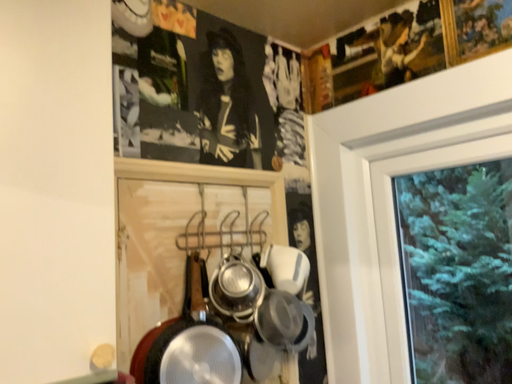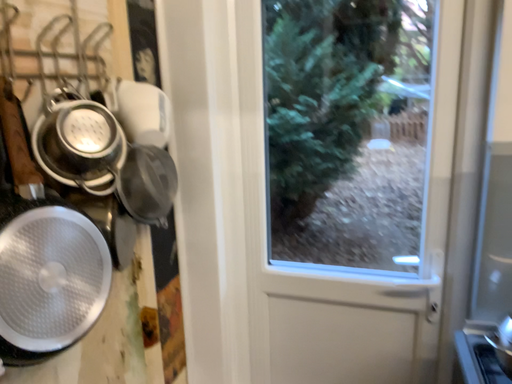
Question: Which way did the camera rotate in the video?

Choices:
 (A) rotated upward
 (B) rotated downward

Answer: (B)